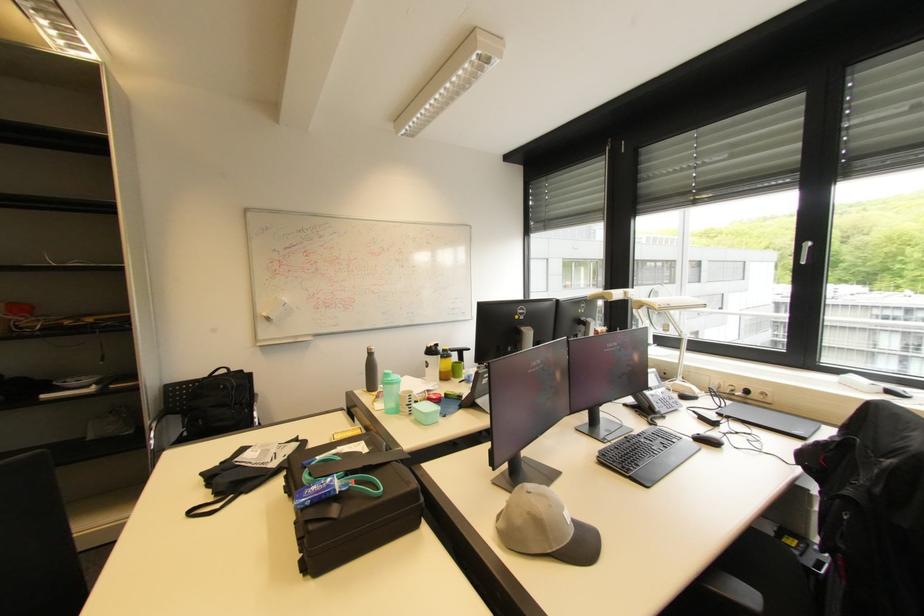
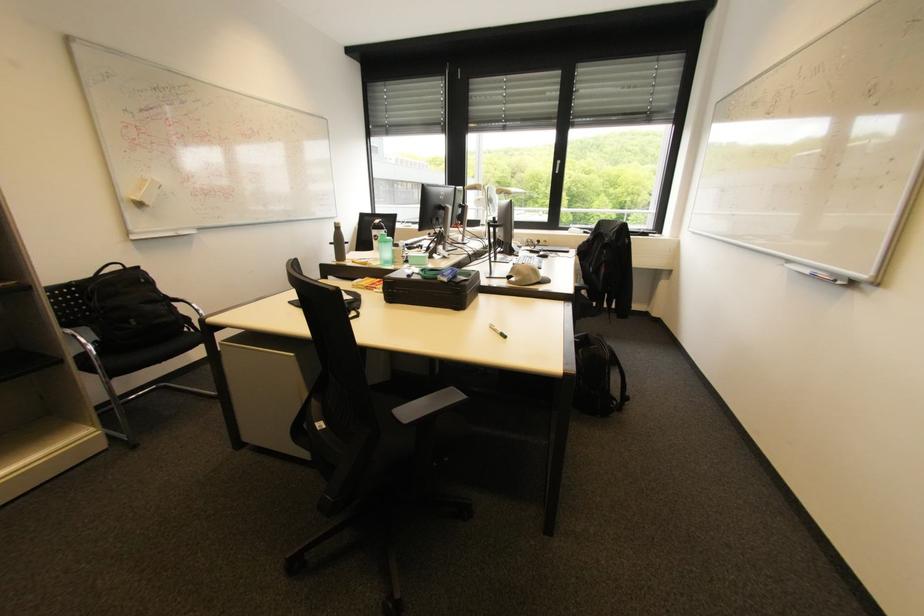
In the second image, find the point that corresponds to the point at 160,424 in the first image.

(74, 331)